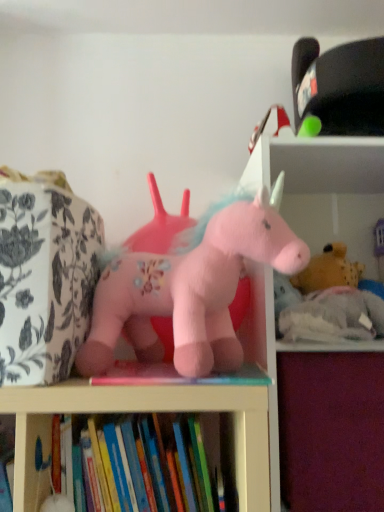
Measure the distance between soft white bookshelf at upper right and camera.

Result: soft white bookshelf at upper right and camera are 30.82 inches apart from each other.

Find the location of a particular element. The image size is (384, 512). soft white bookshelf at upper right is located at coordinates (x=325, y=188).

Based on the photo, is fluffy pink unicorn at center, positioned as the first toy in right-to-left order, turned away from fluffy pink unicorn at center, acting as the first toy starting from the left?

That's not correct — fluffy pink unicorn at center, positioned as the first toy in right-to-left order, is not looking away from fluffy pink unicorn at center, acting as the first toy starting from the left.

Does fluffy pink unicorn at center, which is the first toy in back-to-front order, come behind fluffy pink unicorn at center, which is counted as the 2th toy, starting from the right?

Yes, fluffy pink unicorn at center, which is the first toy in back-to-front order, is further from the viewer.

Where is `toy that is above the fluffy pink unicorn at center, positioned as the first toy in right-to-left order (from a real-world perspective)`? toy that is above the fluffy pink unicorn at center, positioned as the first toy in right-to-left order (from a real-world perspective) is located at coordinates (190, 291).

Can you confirm if fluffy pink unicorn at center, which is the 2th toy in front-to-back order, is taller than fluffy pink unicorn at center, which is the 2th toy from back to front?

In fact, fluffy pink unicorn at center, which is the 2th toy in front-to-back order, may be shorter than fluffy pink unicorn at center, which is the 2th toy from back to front.

Looking at this image, from the image's perspective, does purple fabric drawer at lower right appear lower than fluffy pink unicorn at center, acting as the first toy starting from the left?

Yes, from the image's perspective, purple fabric drawer at lower right is below fluffy pink unicorn at center, acting as the first toy starting from the left.

How many degrees apart are the facing directions of purple fabric drawer at lower right and fluffy pink unicorn at center, which is the 2th toy from back to front?

3.82 degrees.

Does purple fabric drawer at lower right touch fluffy pink unicorn at center, which is counted as the 2th toy, starting from the right?

No, purple fabric drawer at lower right is not touching fluffy pink unicorn at center, which is counted as the 2th toy, starting from the right.

At what (x,y) coordinates should I click in order to perform the action: click on drawer that is below the fluffy pink unicorn at center, which is the 1th toy from front to back (from the image's perspective). Please return your answer as a coordinate pair (x, y). The height and width of the screenshot is (512, 384). Looking at the image, I should click on (331, 430).

In the scene shown: From the image's perspective, which is above, fluffy pink unicorn at center, acting as the first toy starting from the left, or soft white bookshelf at upper right?

fluffy pink unicorn at center, acting as the first toy starting from the left, is shown above in the image.

Is fluffy pink unicorn at center, which is the 2th toy from back to front, positioned with its back to soft white bookshelf at upper right?

No, fluffy pink unicorn at center, which is the 2th toy from back to front, is not facing away from soft white bookshelf at upper right.

Is fluffy pink unicorn at center, which is counted as the 2th toy, starting from the right, thinner than soft white bookshelf at upper right?

Yes, fluffy pink unicorn at center, which is counted as the 2th toy, starting from the right, is thinner than soft white bookshelf at upper right.

Does fluffy pink unicorn at center, acting as the first toy starting from the left, have a lesser height compared to soft white bookshelf at upper right?

Yes.

Between purple fabric drawer at lower right and fluffy pink unicorn at center, positioned as the first toy in right-to-left order, which one has larger size?

purple fabric drawer at lower right is bigger.

Locate an element on the screen. The width and height of the screenshot is (384, 512). drawer that is under the fluffy pink unicorn at center, which is the 2th toy in front-to-back order (from a real-world perspective) is located at coordinates (331, 430).

Could fluffy pink unicorn at center, positioned as the first toy in right-to-left order, be considered to be inside purple fabric drawer at lower right?

No, fluffy pink unicorn at center, positioned as the first toy in right-to-left order, is not a part of purple fabric drawer at lower right.

Which of these two, purple fabric drawer at lower right or fluffy pink unicorn at center, arranged as the 2th toy when viewed from the left, stands shorter?

fluffy pink unicorn at center, arranged as the 2th toy when viewed from the left, is shorter.

In the image, is fluffy pink unicorn at center, which is the first toy in back-to-front order, positioned in front of or behind hardcover book at lower center?

fluffy pink unicorn at center, which is the first toy in back-to-front order, is positioned farther from the viewer than hardcover book at lower center.

Is fluffy pink unicorn at center, arranged as the 2th toy when viewed from the left, shorter than hardcover book at lower center?

No.

Which object is positioned more to the left, fluffy pink unicorn at center, which is the first toy in back-to-front order, or hardcover book at lower center?

Positioned to the left is hardcover book at lower center.

From a real-world perspective, is fluffy pink unicorn at center, which is the 2th toy from back to front, under fluffy pink unicorn at center, which is the first toy in back-to-front order?

No, from a real-world perspective, fluffy pink unicorn at center, which is the 2th toy from back to front, is not below fluffy pink unicorn at center, which is the first toy in back-to-front order.

Locate an element on the screen. The image size is (384, 512). toy above the fluffy pink unicorn at center, positioned as the first toy in right-to-left order (from a real-world perspective) is located at coordinates click(x=190, y=291).

Is fluffy pink unicorn at center, which is the 2th toy from back to front, to the left of fluffy pink unicorn at center, positioned as the first toy in right-to-left order, from the viewer's perspective?

Yes, fluffy pink unicorn at center, which is the 2th toy from back to front, is to the left of fluffy pink unicorn at center, positioned as the first toy in right-to-left order.

Is the position of fluffy pink unicorn at center, which is the 2th toy from back to front, more distant than that of fluffy pink unicorn at center, which is the first toy in back-to-front order?

That is False.

Would you consider fluffy pink unicorn at center, which is the 2th toy in front-to-back order, to be distant from soft white bookshelf at upper right?

No.

From a real-world perspective, which is physically above, fluffy pink unicorn at center, arranged as the 2th toy when viewed from the left, or soft white bookshelf at upper right?

In real-world perspective, fluffy pink unicorn at center, arranged as the 2th toy when viewed from the left, is above.

How different are the orientations of fluffy pink unicorn at center, which is the first toy in back-to-front order, and soft white bookshelf at upper right in degrees?

0.32 degrees separate the facing orientations of fluffy pink unicorn at center, which is the first toy in back-to-front order, and soft white bookshelf at upper right.

This screenshot has width=384, height=512. I want to click on toy located below the fluffy pink unicorn at center, which is the 1th toy from front to back (from the image's perspective), so click(327, 302).

Where is `drawer below the fluffy pink unicorn at center, which is counted as the 2th toy, starting from the right (from a real-world perspective)`? This screenshot has width=384, height=512. drawer below the fluffy pink unicorn at center, which is counted as the 2th toy, starting from the right (from a real-world perspective) is located at coordinates (331, 430).

Based on their spatial positions, is purple fabric drawer at lower right or fluffy pink unicorn at center, positioned as the first toy in right-to-left order, further from fluffy pink unicorn at center, which is counted as the 2th toy, starting from the right?

purple fabric drawer at lower right lies further to fluffy pink unicorn at center, which is counted as the 2th toy, starting from the right, than the other object.

Consider the image. From the image, which object appears to be farther from soft white bookshelf at upper right, fluffy pink unicorn at center, which is the first toy in back-to-front order, or fluffy pink unicorn at center, which is the 1th toy from front to back?

fluffy pink unicorn at center, which is the first toy in back-to-front order, is further to soft white bookshelf at upper right.

Which object lies further to the anchor point fluffy pink unicorn at center, which is counted as the 2th toy, starting from the right, soft white bookshelf at upper right or fluffy pink unicorn at center, which is the first toy in back-to-front order?

soft white bookshelf at upper right is further to fluffy pink unicorn at center, which is counted as the 2th toy, starting from the right.

Estimate the real-world distances between objects in this image. Which object is closer to hardcover book at lower center, purple fabric drawer at lower right or fluffy pink unicorn at center, which is the 2th toy in front-to-back order?

The object closer to hardcover book at lower center is purple fabric drawer at lower right.

Looking at the image, which one is located closer to fluffy pink unicorn at center, positioned as the first toy in right-to-left order, hardcover book at lower center or purple fabric drawer at lower right?

purple fabric drawer at lower right is closer to fluffy pink unicorn at center, positioned as the first toy in right-to-left order.

Estimate the real-world distances between objects in this image. Which object is closer to hardcover book at lower center, fluffy pink unicorn at center, arranged as the 2th toy when viewed from the left, or soft white bookshelf at upper right?

Among the two, fluffy pink unicorn at center, arranged as the 2th toy when viewed from the left, is located nearer to hardcover book at lower center.

Considering their positions, is fluffy pink unicorn at center, positioned as the first toy in right-to-left order, positioned further to purple fabric drawer at lower right than soft white bookshelf at upper right?

soft white bookshelf at upper right.

Considering their positions, is purple fabric drawer at lower right positioned closer to fluffy pink unicorn at center, which is the 2th toy in front-to-back order, than hardcover book at lower center?

purple fabric drawer at lower right.

Find the location of a particular element. The width and height of the screenshot is (384, 512). drawer situated between hardcover book at lower center and soft white bookshelf at upper right from left to right is located at coordinates (331, 430).

What are the coordinates of `bookshelf that lies between fluffy pink unicorn at center, which is the 2th toy in front-to-back order, and purple fabric drawer at lower right from top to bottom` in the screenshot? It's located at (325, 188).

This screenshot has height=512, width=384. Identify the location of toy located between fluffy pink unicorn at center, which is the 2th toy from back to front, and soft white bookshelf at upper right in the left-right direction. (327, 302).

This screenshot has height=512, width=384. What are the coordinates of `toy between hardcover book at lower center and fluffy pink unicorn at center, which is the first toy in back-to-front order` in the screenshot? It's located at (190, 291).